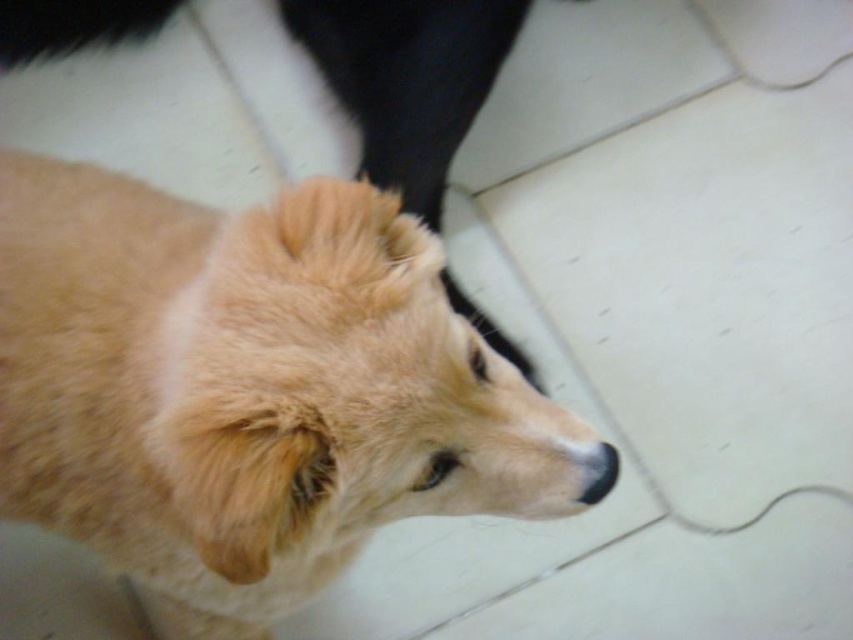
You are holding a 12 inch long stick. If you want to point it at the point at coordinate point (404, 504), will the stick reach that point from your current position?

The point at coordinate point (404, 504) is 25.97 inches away from the camera. Since the stick is only 12 inches long, it will not reach the point.

You are a photographer trying to capture the perfect shot of the fuzzy golden dog at center and the golden fur dog at center. Based on their positions, which one is positioned lower in the frame?

The fuzzy golden dog at center is located below the golden fur dog at center, so the fuzzy golden dog at center is positioned lower in the frame.